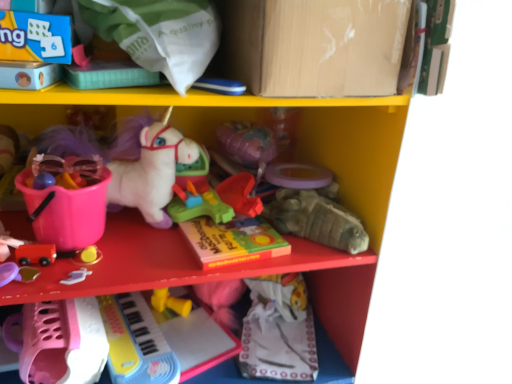
Locate an element on the screen. vacant area that is in front of rubberized plastic toy at center, positioned as the 1th toy in top-to-bottom order is located at coordinates (240, 238).